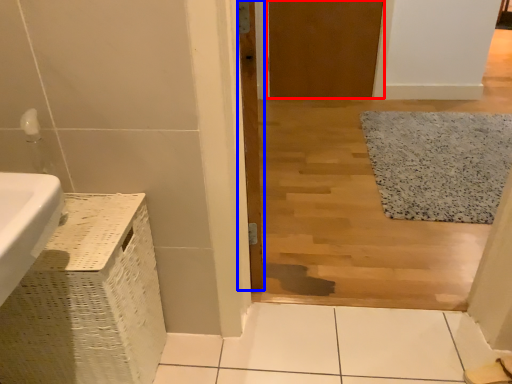
Question: Which object is closer to the camera taking this photo, door (highlighted by a red box) or door (highlighted by a blue box)?

Choices:
 (A) door
 (B) door

Answer: (B)